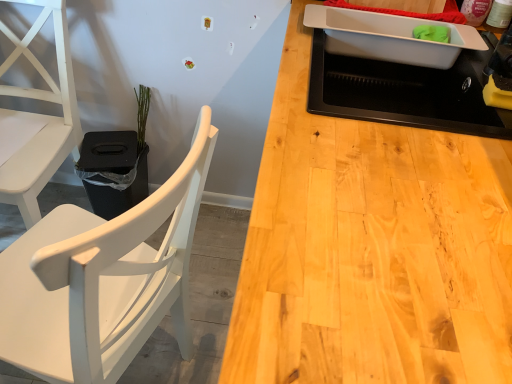
Identify the location of free space above black plastic houseplant at left (from a real-world perspective). (110, 145).